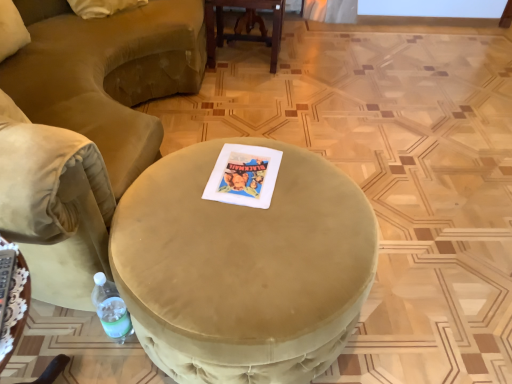
Question: From a real-world perspective, is velvet beige chair at lower left over satin beige ottoman at center, the second table positioned from the right?

Choices:
 (A) yes
 (B) no

Answer: (B)

Question: Does velvet beige chair at lower left have a lesser height compared to satin beige ottoman at center, marked as the second table in a back-to-front arrangement?

Choices:
 (A) yes
 (B) no

Answer: (B)

Question: Does velvet beige chair at lower left have a greater height compared to satin beige ottoman at center, marked as the second table in a back-to-front arrangement?

Choices:
 (A) no
 (B) yes

Answer: (B)

Question: From the image's perspective, would you say velvet beige chair at lower left is shown under satin beige ottoman at center, the second table positioned from the right?

Choices:
 (A) yes
 (B) no

Answer: (B)

Question: Is velvet beige chair at lower left further to camera compared to satin beige ottoman at center, marked as the second table in a back-to-front arrangement?

Choices:
 (A) no
 (B) yes

Answer: (A)

Question: Does point (244, 0) appear closer or farther from the camera than point (289, 337)?

Choices:
 (A) farther
 (B) closer

Answer: (A)

Question: Based on their sizes in the image, would you say wooden table at center, arranged as the 2th table when viewed from the front, is bigger or smaller than suede-like beige ottoman at center?

Choices:
 (A) small
 (B) big

Answer: (A)

Question: Looking at their shapes, would you say wooden table at center, the 1th table viewed from the right, is wider or thinner than suede-like beige ottoman at center?

Choices:
 (A) wide
 (B) thin

Answer: (B)

Question: Relative to suede-like beige ottoman at center, is wooden table at center, the 1th table viewed from the right, in front or behind?

Choices:
 (A) front
 (B) behind

Answer: (B)

Question: From the image's perspective, is wooden table at center, the 1th table in the top-to-bottom sequence, above or below satin beige ottoman at center, which is the 1th table from bottom to top?

Choices:
 (A) above
 (B) below

Answer: (A)

Question: In the image, is wooden table at center, the second table from the left, on the left side or the right side of satin beige ottoman at center, which is the 1th table from bottom to top?

Choices:
 (A) right
 (B) left

Answer: (A)

Question: Is point (276, 23) closer or farther from the camera than point (26, 274)?

Choices:
 (A) closer
 (B) farther

Answer: (B)

Question: In the image, is wooden table at center, which is the 1th table in back-to-front order, positioned in front of or behind satin beige ottoman at center, the second table when ordered from top to bottom?

Choices:
 (A) front
 (B) behind

Answer: (B)

Question: Based on their sizes in the image, would you say satin beige ottoman at center, the first table viewed from the front, is bigger or smaller than wooden table at center, the second table from the left?

Choices:
 (A) small
 (B) big

Answer: (A)

Question: From a real-world perspective, is satin beige ottoman at center, the second table when ordered from top to bottom, positioned above or below wooden table at center, the 1th table in the top-to-bottom sequence?

Choices:
 (A) below
 (B) above

Answer: (B)